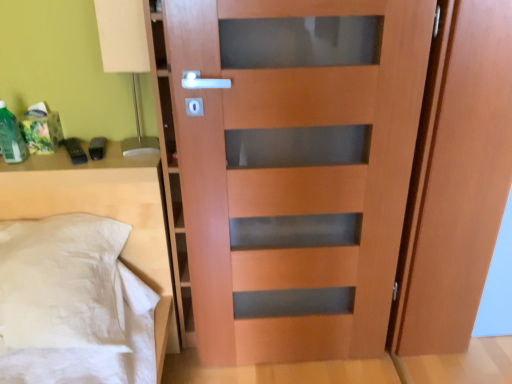
Question: From a real-world perspective, is matte wood door at center physically below matte wood screen door at right?

Choices:
 (A) yes
 (B) no

Answer: (A)

Question: Considering the relative sizes of matte wood door at center and matte wood screen door at right in the image provided, is matte wood door at center taller than matte wood screen door at right?

Choices:
 (A) yes
 (B) no

Answer: (A)

Question: Is matte wood door at center positioned with its back to matte wood screen door at right?

Choices:
 (A) yes
 (B) no

Answer: (B)

Question: Can you confirm if matte wood door at center is thinner than matte wood screen door at right?

Choices:
 (A) no
 (B) yes

Answer: (B)

Question: Is matte wood door at center completely or partially outside of matte wood screen door at right?

Choices:
 (A) no
 (B) yes

Answer: (B)

Question: Can you see matte wood door at center touching matte wood screen door at right?

Choices:
 (A) no
 (B) yes

Answer: (A)

Question: Is white matte table lamp at upper left at the right side of white fabric pillow at left?

Choices:
 (A) yes
 (B) no

Answer: (A)

Question: Does white matte table lamp at upper left contain white fabric pillow at left?

Choices:
 (A) yes
 (B) no

Answer: (B)

Question: Considering the relative sizes of white matte table lamp at upper left and white fabric pillow at left in the image provided, is white matte table lamp at upper left thinner than white fabric pillow at left?

Choices:
 (A) yes
 (B) no

Answer: (A)

Question: From a real-world perspective, is white matte table lamp at upper left located beneath white fabric pillow at left?

Choices:
 (A) yes
 (B) no

Answer: (B)

Question: Is white matte table lamp at upper left directly adjacent to white fabric pillow at left?

Choices:
 (A) yes
 (B) no

Answer: (B)

Question: Does white matte table lamp at upper left have a larger size compared to white fabric pillow at left?

Choices:
 (A) no
 (B) yes

Answer: (A)

Question: Can you confirm if matte wood screen door at right is wider than white matte table lamp at upper left?

Choices:
 (A) no
 (B) yes

Answer: (B)